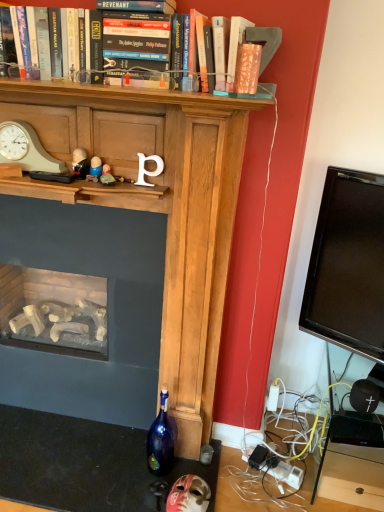
What is the approximate height of matte pink mask at lower center, the 4th toy positioned from the front?

It is 2.45 inches.

This screenshot has height=512, width=384. Find the location of `matte pink mask at lower center, the first toy in the bottom-to-top sequence`. matte pink mask at lower center, the first toy in the bottom-to-top sequence is located at coordinates (188, 495).

I want to click on hardcover book at upper center, so click(x=136, y=45).

The height and width of the screenshot is (512, 384). Find the location of `matte pink paper at upper center`. matte pink paper at upper center is located at coordinates (247, 68).

Looking at this image, is matte plastic figurine at center, arranged as the third toy when ordered from the bottom, positioned far away from matte pink paper at upper center?

No, there isn't a large distance between matte plastic figurine at center, arranged as the third toy when ordered from the bottom, and matte pink paper at upper center.

Is matte pink paper at upper center at the back of matte plastic figurine at center, arranged as the third toy when ordered from the bottom?

No.

Which is closer, (96, 156) or (250, 69)?

Point (96, 156) is positioned farther from the camera compared to point (250, 69).

From a real-world perspective, between matte plastic figurine at center, arranged as the third toy when ordered from the bottom, and matte pink paper at upper center, who is vertically lower?

matte plastic figurine at center, arranged as the third toy when ordered from the bottom, from a real-world perspective.

Is black plastic drawer at lower right placed right next to matte stone figurine at center, acting as the 3th toy starting from the top?

No, black plastic drawer at lower right is not making contact with matte stone figurine at center, acting as the 3th toy starting from the top.

In the scene shown: Is black plastic drawer at lower right situated inside matte stone figurine at center, the fourth toy positioned from the back, or outside?

black plastic drawer at lower right is spatially situated outside matte stone figurine at center, the fourth toy positioned from the back.

From the image's perspective, starting from the black plastic drawer at lower right, which toy is the 1st one above? Please provide its 2D coordinates.

[(107, 176)]

How much distance is there between black plastic drawer at lower right and matte stone figurine at center, the 3th toy positioned from the left?

black plastic drawer at lower right is 4.61 feet away from matte stone figurine at center, the 3th toy positioned from the left.

In the scene shown: From the image's perspective, does hardcover book at upper center appear higher than black plastic drawer at lower right?

Yes, from the image's perspective, hardcover book at upper center is above black plastic drawer at lower right.

Does hardcover book at upper center turn towards black plastic drawer at lower right?

No, hardcover book at upper center is not aimed at black plastic drawer at lower right.

Is hardcover book at upper center surrounding black plastic drawer at lower right?

Definitely not — black plastic drawer at lower right is not inside hardcover book at upper center.

How far apart are matte stone figurine at center, the fourth toy positioned from the back, and matte beige clock at left?

A distance of 26.94 centimeters exists between matte stone figurine at center, the fourth toy positioned from the back, and matte beige clock at left.

Is the depth of matte stone figurine at center, the fourth toy positioned from the back, greater than that of matte beige clock at left?

No, the depth of matte stone figurine at center, the fourth toy positioned from the back, is less than that of matte beige clock at left.

From a real-world perspective, is matte stone figurine at center, positioned as the second toy in bottom-to-top order, positioned under matte beige clock at left based on gravity?

Yes, from a real-world perspective, matte stone figurine at center, positioned as the second toy in bottom-to-top order, is below matte beige clock at left.

Do you think matte stone figurine at center, acting as the 3th toy starting from the top, is within matte beige clock at left, or outside of it?

matte stone figurine at center, acting as the 3th toy starting from the top, lies outside matte beige clock at left.

Find the location of a particular element. speaker behind the matte pink paper at upper center is located at coordinates 364,396.

Relative to matte pink paper at upper center, is black matte speaker at lower right in front or behind?

black matte speaker at lower right is behind matte pink paper at upper center.

Can you confirm if black matte speaker at lower right is wider than matte pink paper at upper center?

Yes, black matte speaker at lower right is wider than matte pink paper at upper center.

Is there a large distance between black matte speaker at lower right and matte pink paper at upper center?

That's right, there is a large distance between black matte speaker at lower right and matte pink paper at upper center.

Is matte pink paper at upper center beside matte plastic figurine at center, acting as the 2th toy starting from the back?

No, matte pink paper at upper center is not with matte plastic figurine at center, acting as the 2th toy starting from the back.

Which is closer to the camera, (250, 77) or (89, 178)?

Point (250, 77) is positioned closer to the camera compared to point (89, 178).

Is matte pink paper at upper center oriented away from matte plastic figurine at center, which is the 3th toy from right to left?

No, matte pink paper at upper center is not facing away from matte plastic figurine at center, which is the 3th toy from right to left.

How much distance is there between matte pink paper at upper center and matte plastic figurine at center, which is the third toy in front-to-back order?

matte pink paper at upper center and matte plastic figurine at center, which is the third toy in front-to-back order, are 55.42 centimeters apart from each other.

Looking at this image, which of these two, blue glass bottle at lower center or hardcover book at upper center, is bigger?

With larger size is hardcover book at upper center.

Considering their positions, is blue glass bottle at lower center located in front of or behind hardcover book at upper center?

Clearly, blue glass bottle at lower center is behind hardcover book at upper center.

Is blue glass bottle at lower center situated inside hardcover book at upper center or outside?

blue glass bottle at lower center exists outside the volume of hardcover book at upper center.

Which is closer to the camera, (x=156, y=462) or (x=128, y=68)?

Clearly, point (x=156, y=462) is more distant from the camera than point (x=128, y=68).

In the image, there is a matte plastic figurine at center, which is counted as the second toy, starting from the left. What are the coordinates of `paperback book above it (from the image's perspective)` in the screenshot? It's located at [x=247, y=68].

From a real-world perspective, count 1st toys upward from the black plastic drawer at lower right and point to it. Please provide its 2D coordinates.

[(107, 176)]

When comparing their distances from black plastic drawer at lower right, does hardcover book at upper center or matte black figurine at center, the 2th toy in the front-to-back sequence, seem closer?

matte black figurine at center, the 2th toy in the front-to-back sequence, is closer to black plastic drawer at lower right.

Considering their positions, is matte pink mask at lower center, the 4th toy positioned from the front, positioned closer to blue glass bottle at lower center than matte plastic figurine at center, which is the third toy in front-to-back order?

The object closer to blue glass bottle at lower center is matte pink mask at lower center, the 4th toy positioned from the front.

Which object lies further to the anchor point matte stone figurine at center, which ranks as the 1th toy in front-to-back order, black matte speaker at lower right or matte pink paper at upper center?

black matte speaker at lower right lies further to matte stone figurine at center, which ranks as the 1th toy in front-to-back order, than the other object.

Considering their positions, is matte beige clock at left positioned further to black matte speaker at lower right than matte plastic figurine at center, acting as the 2th toy starting from the back?

matte beige clock at left lies further to black matte speaker at lower right than the other object.

Estimate the real-world distances between objects in this image. Which object is closer to matte plastic figurine at center, which is the third toy in front-to-back order, matte pink mask at lower center, marked as the fourth toy in a left-to-right arrangement, or matte stone figurine at center, positioned as the second toy in bottom-to-top order?

matte stone figurine at center, positioned as the second toy in bottom-to-top order, is positioned closer to the anchor matte plastic figurine at center, which is the third toy in front-to-back order.

Based on their spatial positions, is matte beige clock at left or blue glass bottle at lower center closer to matte plastic figurine at center, which is counted as the second toy, starting from the left?

Based on the image, matte beige clock at left appears to be nearer to matte plastic figurine at center, which is counted as the second toy, starting from the left.

Estimate the real-world distances between objects in this image. Which object is further from matte pink mask at lower center, the 4th toy positioned from the front, matte stone figurine at center, acting as the 2th toy starting from the right, or hardcover book at upper center?

hardcover book at upper center.

Looking at this image, when comparing their distances from matte stone figurine at center, acting as the 3th toy starting from the top, does black matte speaker at lower right or hardcover book at upper center seem further?

black matte speaker at lower right.

You are a GUI agent. You are given a task and a screenshot of the screen. Output one action in this format:
    pyautogui.click(x=<x>, y=<y>)
    Task: Click on the bottle that lies between hardcover book at upper center and black plastic drawer at lower right from top to bottom
    
    Given the screenshot: What is the action you would take?
    pyautogui.click(x=160, y=440)

This screenshot has height=512, width=384. I want to click on drawer that lies between matte black figurine at center, placed as the 4th toy when sorted from bottom to top, and matte pink mask at lower center, marked as the 1th toy in a back-to-front arrangement, from top to bottom, so click(x=353, y=475).

At what (x,y) coordinates should I click in order to perform the action: click on speaker between hardcover book at upper center and black plastic drawer at lower right in the up-down direction. Please return your answer as a coordinate pair (x, y). Looking at the image, I should click on (364, 396).

Image resolution: width=384 pixels, height=512 pixels. Identify the location of book between matte beige clock at left and matte pink paper at upper center from left to right. (136, 45).